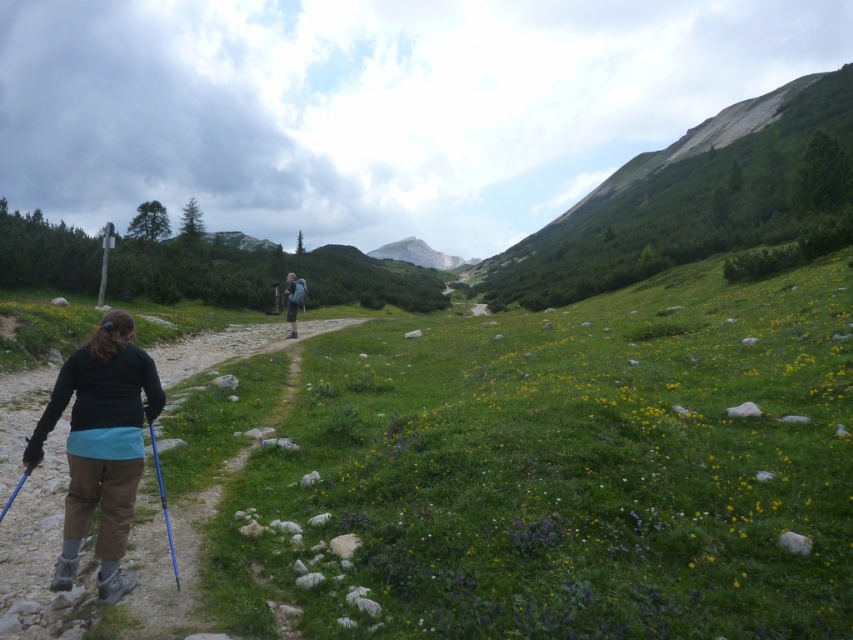
Does point (74, 538) come behind point (177, 572)?

That is False.

Can you confirm if matte black jacket at lower left is thinner than blue plastic ski pole at lower left?

In fact, matte black jacket at lower left might be wider than blue plastic ski pole at lower left.

Between point (120, 353) and point (148, 424), which one is positioned in front?

Point (120, 353) is in front.

The image size is (853, 640). Identify the location of matte black jacket at lower left. (102, 445).

Measure the distance from gravel path at center to blue plastic ski pole at lower left.

9.36 meters

This screenshot has height=640, width=853. What do you see at coordinates (35, 541) in the screenshot? I see `gravel path at center` at bounding box center [35, 541].

Describe the element at coordinates (35, 541) in the screenshot. The height and width of the screenshot is (640, 853). I see `gravel path at center` at that location.

This screenshot has height=640, width=853. What are the coordinates of `gravel path at center` in the screenshot? It's located at (35, 541).

Is point (160, 468) more distant than point (291, 320)?

No.

Locate an element on the screen. The image size is (853, 640). blue plastic ski pole at lower left is located at coordinates (163, 500).

Consider the image. Measure the distance between point (155, 448) and camera.

Point (155, 448) is 20.37 meters away from camera.

Where is `blue plastic ski pole at lower left`? Image resolution: width=853 pixels, height=640 pixels. blue plastic ski pole at lower left is located at coordinates (163, 500).